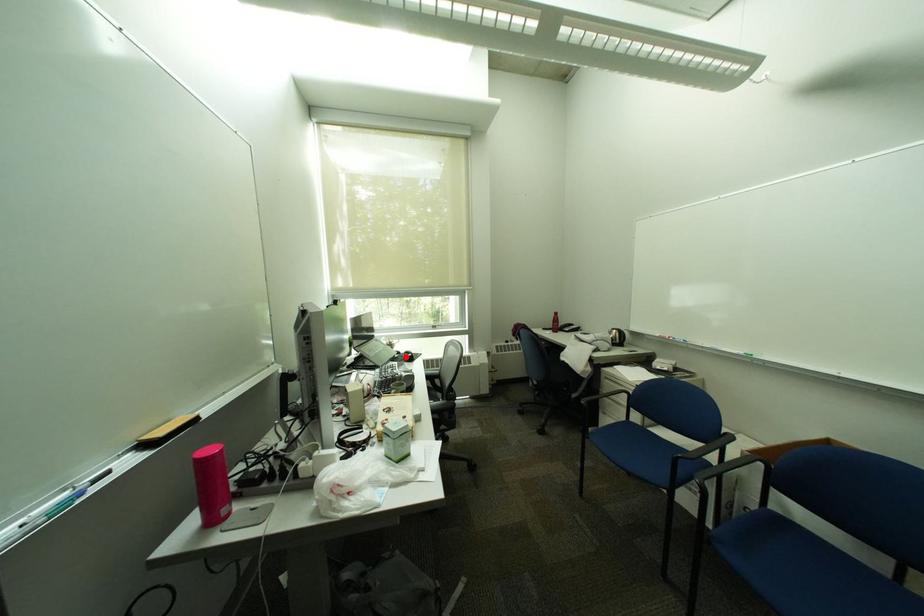
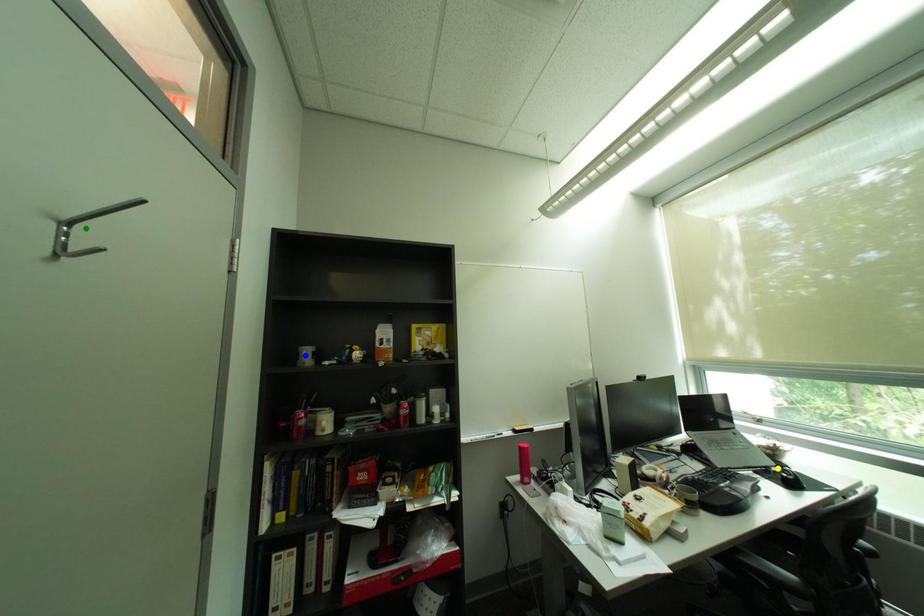
Question: I am providing you with two images of the same scene from different viewpoints. A red point is marked on the first image. You are given multiple points on the second image. Which point in image 2 represents the same 3d spot as the red point in image 1?

Choices:
 (A) green point
 (B) yellow point
 (C) blue point

Answer: (B)